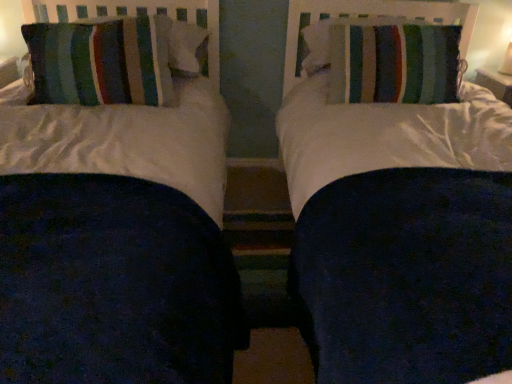
Question: Can you confirm if striped fabric pillow at left, arranged as the second pillow when viewed from the right, is bigger than striped fabric pillow at upper right, which is the 2th pillow in left-to-right order?

Choices:
 (A) yes
 (B) no

Answer: (A)

Question: Can you confirm if striped fabric pillow at left, the 1th pillow viewed from the left, is taller than striped fabric pillow at upper right, placed as the 1th pillow when sorted from right to left?

Choices:
 (A) yes
 (B) no

Answer: (A)

Question: Does striped fabric pillow at left, arranged as the second pillow when viewed from the right, appear on the right side of striped fabric pillow at upper right, which is the 2th pillow in left-to-right order?

Choices:
 (A) no
 (B) yes

Answer: (A)

Question: Is striped fabric pillow at left, the 1th pillow viewed from the left, looking in the opposite direction of striped fabric pillow at upper right, which is the 2th pillow in left-to-right order?

Choices:
 (A) no
 (B) yes

Answer: (A)

Question: Can you confirm if striped fabric pillow at left, the 1th pillow viewed from the left, is smaller than striped fabric pillow at upper right, placed as the 1th pillow when sorted from right to left?

Choices:
 (A) no
 (B) yes

Answer: (A)

Question: Does striped fabric pillow at left, the 1th pillow viewed from the left, have a lesser width compared to striped fabric pillow at upper right, placed as the 1th pillow when sorted from right to left?

Choices:
 (A) no
 (B) yes

Answer: (B)

Question: Is striped fabric pillow at upper right, placed as the 1th pillow when sorted from right to left, placed right next to striped fabric pillow at left, arranged as the second pillow when viewed from the right?

Choices:
 (A) yes
 (B) no

Answer: (B)

Question: Is striped fabric pillow at left, arranged as the second pillow when viewed from the right, at the back of striped fabric pillow at upper right, which is the 2th pillow in left-to-right order?

Choices:
 (A) no
 (B) yes

Answer: (A)

Question: Considering the relative sizes of striped fabric pillow at upper right, placed as the 1th pillow when sorted from right to left, and striped fabric pillow at left, arranged as the second pillow when viewed from the right, in the image provided, is striped fabric pillow at upper right, placed as the 1th pillow when sorted from right to left, smaller than striped fabric pillow at left, arranged as the second pillow when viewed from the right,?

Choices:
 (A) yes
 (B) no

Answer: (A)

Question: Considering the relative sizes of striped fabric pillow at upper right, which is the 2th pillow in left-to-right order, and striped fabric pillow at left, the 1th pillow viewed from the left, in the image provided, is striped fabric pillow at upper right, which is the 2th pillow in left-to-right order, shorter than striped fabric pillow at left, the 1th pillow viewed from the left,?

Choices:
 (A) no
 (B) yes

Answer: (B)

Question: From the image's perspective, is striped fabric pillow at upper right, which is the 2th pillow in left-to-right order, under striped fabric pillow at left, the 1th pillow viewed from the left?

Choices:
 (A) no
 (B) yes

Answer: (A)

Question: Is striped fabric pillow at upper right, placed as the 1th pillow when sorted from right to left, completely or partially outside of striped fabric pillow at left, the 1th pillow viewed from the left?

Choices:
 (A) yes
 (B) no

Answer: (A)

Question: From the image's perspective, relative to striped fabric pillow at left, arranged as the second pillow when viewed from the right, is striped fabric pillow at upper right, placed as the 1th pillow when sorted from right to left, above or below?

Choices:
 (A) below
 (B) above

Answer: (B)